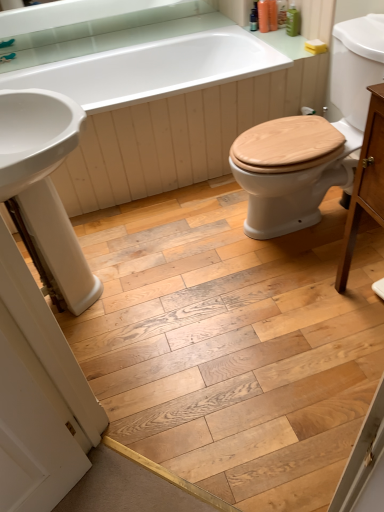
Question: Is white glossy bathtub at upper center wider than brushed metal faucet at upper left?

Choices:
 (A) no
 (B) yes

Answer: (B)

Question: Does white glossy bathtub at upper center turn towards brushed metal faucet at upper left?

Choices:
 (A) no
 (B) yes

Answer: (A)

Question: Does white glossy bathtub at upper center lie behind brushed metal faucet at upper left?

Choices:
 (A) yes
 (B) no

Answer: (B)

Question: Is brushed metal faucet at upper left inside white glossy bathtub at upper center?

Choices:
 (A) no
 (B) yes

Answer: (A)

Question: Is white glossy bathtub at upper center taller than brushed metal faucet at upper left?

Choices:
 (A) no
 (B) yes

Answer: (B)

Question: Looking at their shapes, would you say wooden at right is wider or thinner than brushed metal faucet at upper left?

Choices:
 (A) thin
 (B) wide

Answer: (B)

Question: In the image, is wooden at right positioned in front of or behind brushed metal faucet at upper left?

Choices:
 (A) front
 (B) behind

Answer: (A)

Question: Considering the positions of wooden at right and brushed metal faucet at upper left in the image, is wooden at right bigger or smaller than brushed metal faucet at upper left?

Choices:
 (A) small
 (B) big

Answer: (B)

Question: From the image's perspective, is wooden at right above or below brushed metal faucet at upper left?

Choices:
 (A) above
 (B) below

Answer: (B)

Question: In the image, is white glossy sink at left positioned in front of or behind wooden at right?

Choices:
 (A) front
 (B) behind

Answer: (A)

Question: Is white glossy sink at left inside the boundaries of wooden at right, or outside?

Choices:
 (A) inside
 (B) outside

Answer: (B)

Question: Looking at the image, does white glossy sink at left seem bigger or smaller compared to wooden at right?

Choices:
 (A) small
 (B) big

Answer: (A)

Question: In the image, is white glossy sink at left on the left side or the right side of wooden at right?

Choices:
 (A) right
 (B) left

Answer: (B)

Question: In terms of width, does wooden at right look wider or thinner when compared to light brown wood cabinet at right?

Choices:
 (A) thin
 (B) wide

Answer: (B)

Question: Visually, is wooden at right positioned to the left or to the right of light brown wood cabinet at right?

Choices:
 (A) right
 (B) left

Answer: (B)